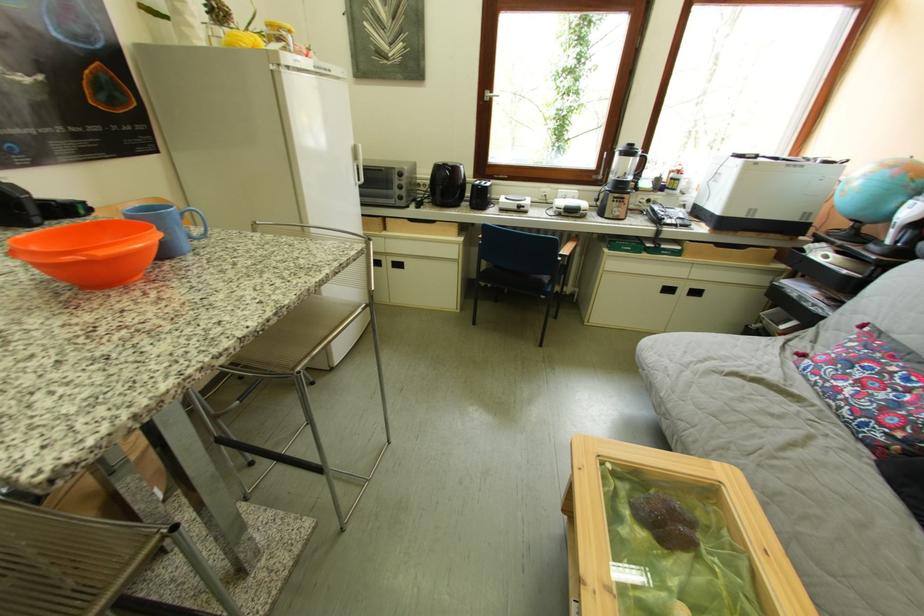
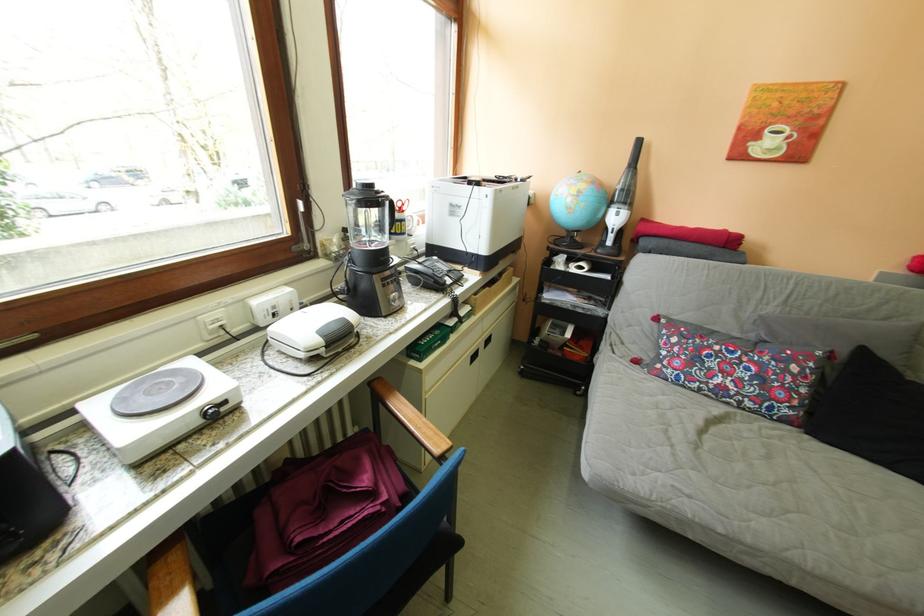
The point at (x=849, y=374) is marked in the first image. Where is the corresponding point in the second image?

(714, 373)